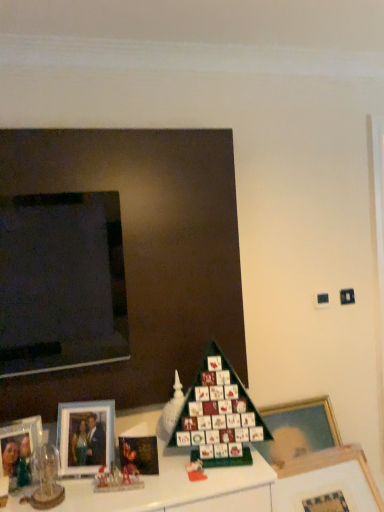
The width and height of the screenshot is (384, 512). Describe the element at coordinates (85, 436) in the screenshot. I see `matte silver picture frame at lower left, the third picture frame positioned from the right` at that location.

Measure the distance between matte plastic toy at lower center and camera.

matte plastic toy at lower center is 5.13 feet from camera.

This screenshot has width=384, height=512. What do you see at coordinates (19, 450) in the screenshot?
I see `clear glass photo frame at lower left, which is counted as the first picture frame, starting from the left` at bounding box center [19, 450].

Describe the element at coordinates (138, 455) in the screenshot. I see `matte black picture frame at lower left, placed as the 3th picture frame when sorted from left to right` at that location.

The width and height of the screenshot is (384, 512). I want to click on wooden picture frame at lower right, which ranks as the 4th picture frame in left-to-right order, so click(327, 480).

Measure the distance between point (227, 368) and camera.

The distance of point (227, 368) from camera is 5.55 feet.

Measure the distance between green cardboard christmas tree at center and camera.

green cardboard christmas tree at center is 1.65 meters away from camera.

Find the location of `matte silver picture frame at lower left, the second picture frame when ordered from left to right`. matte silver picture frame at lower left, the second picture frame when ordered from left to right is located at coordinates (85, 436).

Considering the sizes of matte silver picture frame at lower left, the third picture frame positioned from the right, and green cardboard christmas tree at center in the image, is matte silver picture frame at lower left, the third picture frame positioned from the right, taller or shorter than green cardboard christmas tree at center?

In the image, matte silver picture frame at lower left, the third picture frame positioned from the right, appears to be shorter than green cardboard christmas tree at center.

Based on their sizes in the image, would you say matte silver picture frame at lower left, the third picture frame positioned from the right, is bigger or smaller than green cardboard christmas tree at center?

Clearly, matte silver picture frame at lower left, the third picture frame positioned from the right, is smaller in size than green cardboard christmas tree at center.

Could you tell me if matte silver picture frame at lower left, the second picture frame when ordered from left to right, is facing green cardboard christmas tree at center?

No, matte silver picture frame at lower left, the second picture frame when ordered from left to right, is not aimed at green cardboard christmas tree at center.

Does matte silver picture frame at lower left, the third picture frame positioned from the right, have a lesser width compared to green cardboard christmas tree at center?

Yes, matte silver picture frame at lower left, the third picture frame positioned from the right, is thinner than green cardboard christmas tree at center.

Is matte plastic toy at lower center to the left or to the right of green cardboard christmas tree at center in the image?

matte plastic toy at lower center is to the left of green cardboard christmas tree at center.

From the image's perspective, between matte plastic toy at lower center and green cardboard christmas tree at center, who is located below?

matte plastic toy at lower center.

Is matte plastic toy at lower center not within green cardboard christmas tree at center?

That's incorrect, matte plastic toy at lower center is not completely outside green cardboard christmas tree at center.

Who is smaller, matte plastic toy at lower center or green cardboard christmas tree at center?

matte plastic toy at lower center.

Which object is positioned more to the left, matte black picture frame at lower left, placed as the 3th picture frame when sorted from left to right, or matte plastic toy at lower center?

matte black picture frame at lower left, placed as the 3th picture frame when sorted from left to right, is more to the left.

From the image's perspective, is matte black picture frame at lower left, placed as the 3th picture frame when sorted from left to right, above or below matte plastic toy at lower center?

From the image's perspective, matte black picture frame at lower left, placed as the 3th picture frame when sorted from left to right, appears above matte plastic toy at lower center.

Considering the sizes of objects matte black picture frame at lower left, placed as the 3th picture frame when sorted from left to right, and matte plastic toy at lower center in the image provided, who is thinner, matte black picture frame at lower left, placed as the 3th picture frame when sorted from left to right, or matte plastic toy at lower center?

matte plastic toy at lower center is thinner.

Does matte black picture frame at lower left, placed as the 3th picture frame when sorted from left to right, lie behind matte plastic toy at lower center?

That is True.

Measure the distance between wooden photo frame at lower left and wooden picture frame at lower right, which ranks as the 4th picture frame in left-to-right order.

wooden photo frame at lower left and wooden picture frame at lower right, which ranks as the 4th picture frame in left-to-right order, are 17.89 inches apart.

From their relative heights in the image, would you say wooden photo frame at lower left is taller or shorter than wooden picture frame at lower right, the first picture frame in the right-to-left sequence?

Considering their sizes, wooden photo frame at lower left has more height than wooden picture frame at lower right, the first picture frame in the right-to-left sequence.

Considering the positions of point (229, 476) and point (321, 479), is point (229, 476) closer or farther from the camera than point (321, 479)?

Point (229, 476) appears to be closer to the viewer than point (321, 479).

Can you confirm if wooden photo frame at lower left is bigger than wooden picture frame at lower right, which ranks as the 4th picture frame in left-to-right order?

Indeed, wooden photo frame at lower left has a larger size compared to wooden picture frame at lower right, which ranks as the 4th picture frame in left-to-right order.

Does matte black picture frame at lower left, placed as the 3th picture frame when sorted from left to right, have a larger size compared to matte silver picture frame at lower left, the second picture frame when ordered from left to right?

No, matte black picture frame at lower left, placed as the 3th picture frame when sorted from left to right, is not bigger than matte silver picture frame at lower left, the second picture frame when ordered from left to right.

How different are the orientations of matte black picture frame at lower left, placed as the 3th picture frame when sorted from left to right, and matte silver picture frame at lower left, the second picture frame when ordered from left to right, in degrees?

They differ by 1.2 degrees in their facing directions.

From a real-world perspective, is matte black picture frame at lower left, placed as the 3th picture frame when sorted from left to right, physically above matte silver picture frame at lower left, the third picture frame positioned from the right?

No, from a real-world perspective, matte black picture frame at lower left, placed as the 3th picture frame when sorted from left to right, is not over matte silver picture frame at lower left, the third picture frame positioned from the right

Considering the relative positions of matte black picture frame at lower left, acting as the 2th picture frame starting from the right, and matte silver picture frame at lower left, the third picture frame positioned from the right, in the image provided, is matte black picture frame at lower left, acting as the 2th picture frame starting from the right, to the left or to the right of matte silver picture frame at lower left, the third picture frame positioned from the right,?

In the image, matte black picture frame at lower left, acting as the 2th picture frame starting from the right, appears on the right side of matte silver picture frame at lower left, the third picture frame positioned from the right.

Which of these two, wooden photo frame at lower left or matte silver picture frame at lower left, the second picture frame when ordered from left to right, stands taller?

Standing taller between the two is wooden photo frame at lower left.

How different are the orientations of wooden photo frame at lower left and matte silver picture frame at lower left, the second picture frame when ordered from left to right, in degrees?

There is a 19.4-degree angle between the facing directions of wooden photo frame at lower left and matte silver picture frame at lower left, the second picture frame when ordered from left to right.

Between wooden photo frame at lower left and matte silver picture frame at lower left, the second picture frame when ordered from left to right, which one has smaller size?

matte silver picture frame at lower left, the second picture frame when ordered from left to right, is smaller.

From the picture: From the image's perspective, would you say matte plastic toy at lower center is positioned over matte silver picture frame at lower left, the third picture frame positioned from the right?

Incorrect, from the image's perspective, matte plastic toy at lower center is lower than matte silver picture frame at lower left, the third picture frame positioned from the right.

From a real-world perspective, is matte plastic toy at lower center on top of matte silver picture frame at lower left, the third picture frame positioned from the right?

Incorrect, from a real-world perspective, matte plastic toy at lower center is lower than matte silver picture frame at lower left, the third picture frame positioned from the right.

Can you confirm if matte plastic toy at lower center is smaller than matte silver picture frame at lower left, the third picture frame positioned from the right?

Indeed, matte plastic toy at lower center has a smaller size compared to matte silver picture frame at lower left, the third picture frame positioned from the right.

Can you confirm if matte plastic toy at lower center is taller than matte silver picture frame at lower left, the second picture frame when ordered from left to right?

Incorrect, the height of matte plastic toy at lower center is not larger of that of matte silver picture frame at lower left, the second picture frame when ordered from left to right.

Where is `christmas tree above the matte silver picture frame at lower left, the third picture frame positioned from the right (from a real-world perspective)`? Image resolution: width=384 pixels, height=512 pixels. christmas tree above the matte silver picture frame at lower left, the third picture frame positioned from the right (from a real-world perspective) is located at coordinates (218, 413).

Locate an element on the screen. This screenshot has height=512, width=384. toy beneath the green cardboard christmas tree at center (from a real-world perspective) is located at coordinates (195, 468).

Based on the photo, from the image, which object appears to be nearer to matte black picture frame at lower left, acting as the 2th picture frame starting from the right, clear glass photo frame at lower left, which is counted as the first picture frame, starting from the left, or matte silver picture frame at lower left, the second picture frame when ordered from left to right?

matte silver picture frame at lower left, the second picture frame when ordered from left to right, is positioned closer to the anchor matte black picture frame at lower left, acting as the 2th picture frame starting from the right.

When comparing their distances from green cardboard christmas tree at center, does matte black picture frame at lower left, placed as the 3th picture frame when sorted from left to right, or matte plastic toy at lower center seem further?

matte black picture frame at lower left, placed as the 3th picture frame when sorted from left to right, lies further to green cardboard christmas tree at center than the other object.

From the image, which object appears to be farther from clear glass photo frame at lower left, which is counted as the first picture frame, starting from the left, matte black picture frame at lower left, acting as the 2th picture frame starting from the right, or wooden picture frame at lower right, the first picture frame in the right-to-left sequence?

Based on the image, wooden picture frame at lower right, the first picture frame in the right-to-left sequence, appears to be further to clear glass photo frame at lower left, which is counted as the first picture frame, starting from the left.

Based on their spatial positions, is green cardboard christmas tree at center or wooden picture frame at lower right, the first picture frame in the right-to-left sequence, closer to matte plastic toy at lower center?

green cardboard christmas tree at center.

Looking at this image, estimate the real-world distances between objects in this image. Which object is closer to green cardboard christmas tree at center, matte plastic toy at lower center or wooden picture frame at lower right, which ranks as the 4th picture frame in left-to-right order?

matte plastic toy at lower center is closer to green cardboard christmas tree at center.

Estimate the real-world distances between objects in this image. Which object is further from matte black picture frame at lower left, acting as the 2th picture frame starting from the right, matte plastic toy at lower center or wooden picture frame at lower right, the first picture frame in the right-to-left sequence?

wooden picture frame at lower right, the first picture frame in the right-to-left sequence.

From the image, which object appears to be farther from matte plastic toy at lower center, wooden picture frame at lower right, which ranks as the 4th picture frame in left-to-right order, or green cardboard christmas tree at center?

wooden picture frame at lower right, which ranks as the 4th picture frame in left-to-right order, is further to matte plastic toy at lower center.

Looking at the image, which one is located further to green cardboard christmas tree at center, wooden picture frame at lower right, which ranks as the 4th picture frame in left-to-right order, or matte black picture frame at lower left, placed as the 3th picture frame when sorted from left to right?

wooden picture frame at lower right, which ranks as the 4th picture frame in left-to-right order.

Find the location of a particular element. toy between clear glass photo frame at lower left, which is counted as the first picture frame, starting from the left, and wooden picture frame at lower right, which ranks as the 4th picture frame in left-to-right order is located at coordinates (195, 468).

This screenshot has width=384, height=512. Find the location of `picture frame situated between matte silver picture frame at lower left, the second picture frame when ordered from left to right, and wooden picture frame at lower right, which ranks as the 4th picture frame in left-to-right order, from left to right`. picture frame situated between matte silver picture frame at lower left, the second picture frame when ordered from left to right, and wooden picture frame at lower right, which ranks as the 4th picture frame in left-to-right order, from left to right is located at coordinates (x=138, y=455).

Locate an element on the screen. furniture situated between clear glass photo frame at lower left, which is the fourth picture frame from right to left, and matte plastic toy at lower center from left to right is located at coordinates (180, 489).

Where is `furniture between clear glass photo frame at lower left, which is counted as the first picture frame, starting from the left, and matte black picture frame at lower left, placed as the 3th picture frame when sorted from left to right, in the horizontal direction`? The height and width of the screenshot is (512, 384). furniture between clear glass photo frame at lower left, which is counted as the first picture frame, starting from the left, and matte black picture frame at lower left, placed as the 3th picture frame when sorted from left to right, in the horizontal direction is located at coordinates (180, 489).